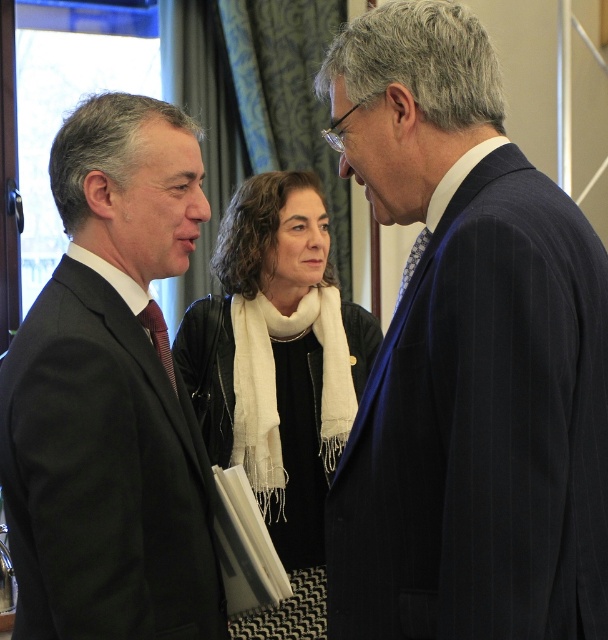
You are standing in the room and want to reach a point that is 1.28 meters away from you. Is the point at coordinates point (426, 480) within that distance?

The distance of point (426, 480) from camera is 1.28 meters, so yes, the point at coordinates point (426, 480) is exactly 1.28 meters away from you.

You are a photographer setting up for a group photo. You need to arrange the two people in the image so that the dark blue pinstripe suit at right and the black suit at left are both visible in the frame. Based on their current positions, which person should be moved closer to the center to ensure both are fully visible?

The dark blue pinstripe suit at right should be moved closer to the center because it is currently positioned over the black suit at left, which might block part of the black suit at left if not adjusted.